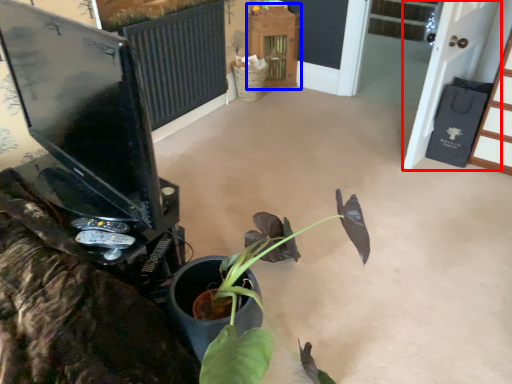
Question: Which object is closer to the camera taking this photo, screen door (highlighted by a red box) or furniture (highlighted by a blue box)?

Choices:
 (A) screen door
 (B) furniture

Answer: (A)